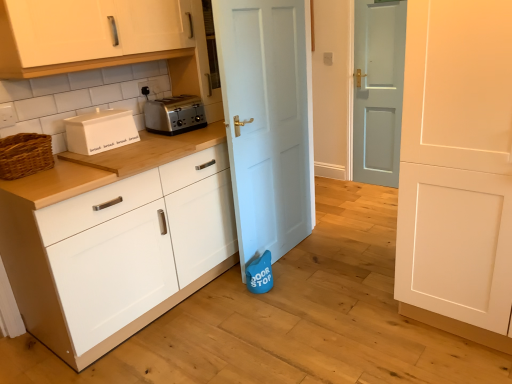
Question: Considering the relative positions of light blue wooden door at center, which is counted as the third door, starting from the front, and white glossy cabinet at upper left, placed as the second cabinetry when sorted from bottom to top, in the image provided, is light blue wooden door at center, which is counted as the third door, starting from the front, to the left of white glossy cabinet at upper left, placed as the second cabinetry when sorted from bottom to top, from the viewer's perspective?

Choices:
 (A) yes
 (B) no

Answer: (B)

Question: From the image's perspective, would you say light blue wooden door at center, acting as the first door starting from the back, is positioned over white glossy cabinet at upper left, which is counted as the first cabinetry, starting from the top?

Choices:
 (A) yes
 (B) no

Answer: (B)

Question: Considering the relative sizes of light blue wooden door at center, which is counted as the third door, starting from the front, and white glossy cabinet at upper left, placed as the second cabinetry when sorted from bottom to top, in the image provided, is light blue wooden door at center, which is counted as the third door, starting from the front, thinner than white glossy cabinet at upper left, placed as the second cabinetry when sorted from bottom to top,?

Choices:
 (A) no
 (B) yes

Answer: (B)

Question: From a real-world perspective, is light blue wooden door at center, which is counted as the third door, starting from the front, physically above white glossy cabinet at upper left, placed as the second cabinetry when sorted from bottom to top?

Choices:
 (A) no
 (B) yes

Answer: (A)

Question: Is light blue wooden door at center, which is counted as the third door, starting from the front, placed right next to white glossy cabinet at upper left, placed as the second cabinetry when sorted from bottom to top?

Choices:
 (A) yes
 (B) no

Answer: (B)

Question: Considering the relative sizes of light blue wooden door at center, acting as the first door starting from the back, and white glossy cabinet at upper left, placed as the second cabinetry when sorted from bottom to top, in the image provided, is light blue wooden door at center, acting as the first door starting from the back, taller than white glossy cabinet at upper left, placed as the second cabinetry when sorted from bottom to top,?

Choices:
 (A) yes
 (B) no

Answer: (A)

Question: From a real-world perspective, is light blue wooden door at center, which is counted as the third door, starting from the front, positioned under white matte door at right, which is the first door from front to back, based on gravity?

Choices:
 (A) yes
 (B) no

Answer: (B)

Question: From a real-world perspective, does light blue wooden door at center, which is counted as the third door, starting from the front, stand above white matte door at right, marked as the third door in a back-to-front arrangement?

Choices:
 (A) yes
 (B) no

Answer: (A)

Question: From the image's perspective, is light blue wooden door at center, acting as the first door starting from the back, under white matte door at right, marked as the third door in a back-to-front arrangement?

Choices:
 (A) no
 (B) yes

Answer: (A)

Question: Considering the relative positions of light blue wooden door at center, acting as the first door starting from the back, and white matte door at right, which is the first door from front to back, in the image provided, is light blue wooden door at center, acting as the first door starting from the back, to the left of white matte door at right, which is the first door from front to back, from the viewer's perspective?

Choices:
 (A) no
 (B) yes

Answer: (A)

Question: Is light blue wooden door at center, which is counted as the third door, starting from the front, smaller than white matte door at right, marked as the third door in a back-to-front arrangement?

Choices:
 (A) yes
 (B) no

Answer: (A)

Question: Is white matte door at right, marked as the third door in a back-to-front arrangement, surrounded by light blue wooden door at center, acting as the first door starting from the back?

Choices:
 (A) yes
 (B) no

Answer: (B)

Question: Does white matte bread bin at left have a greater height compared to light blue matte door at center, the 2th door positioned from the back?

Choices:
 (A) no
 (B) yes

Answer: (A)